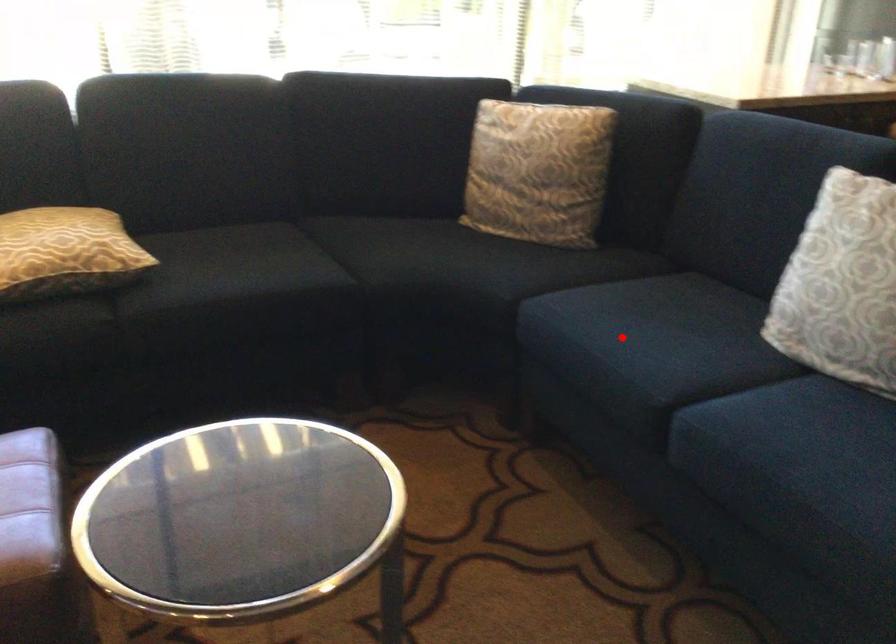
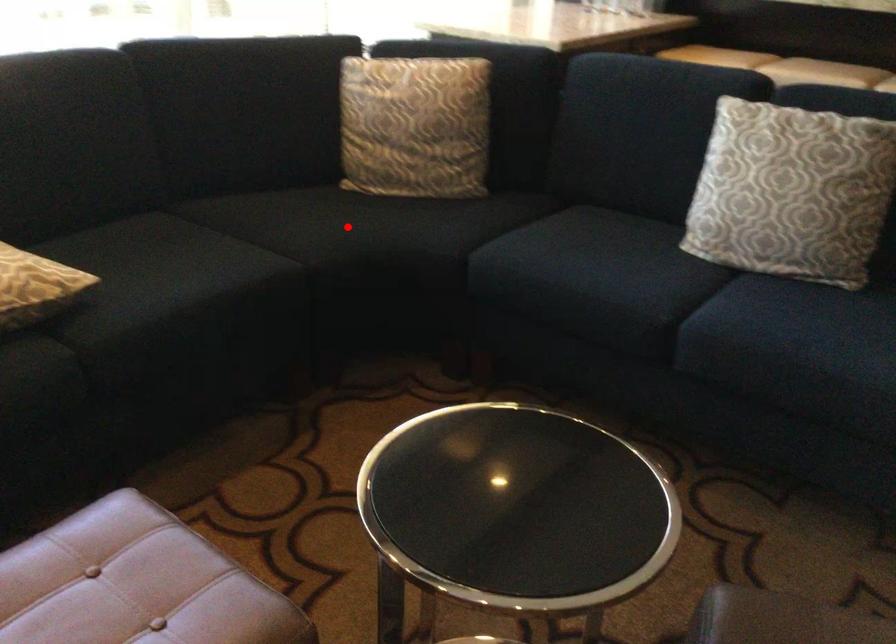
I am providing you with two images of the same scene from different viewpoints. A red point is marked on the first image and another point is marked on the second image. Does the point marked in image1 correspond to the same location as the one in image2?

No